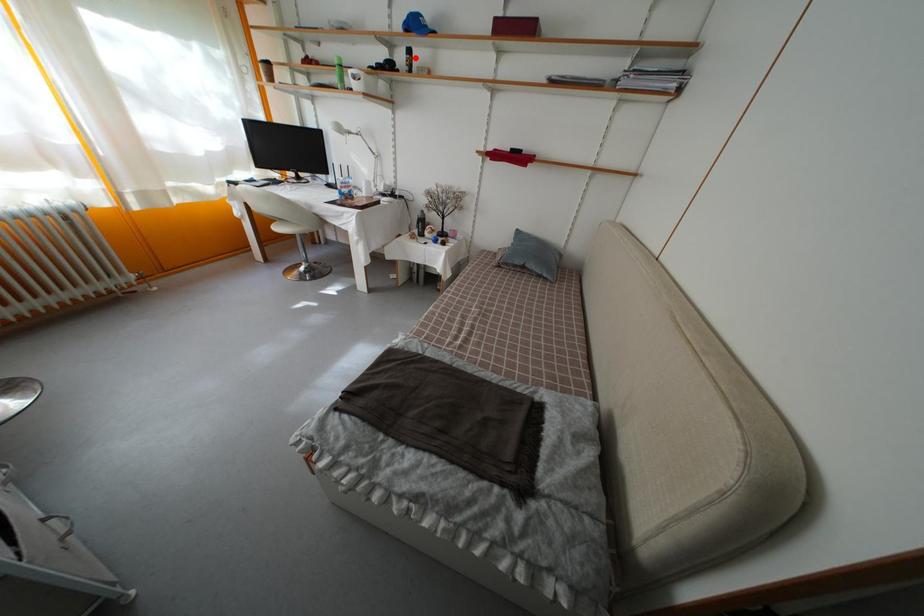
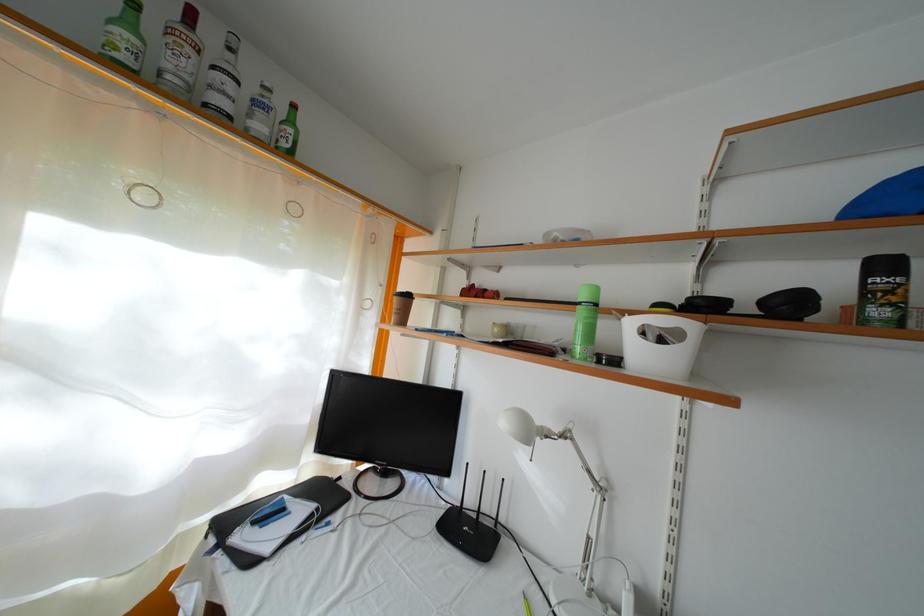
Locate, in the second image, the point that corresponds to the highlighted location in the first image.

(891, 273)